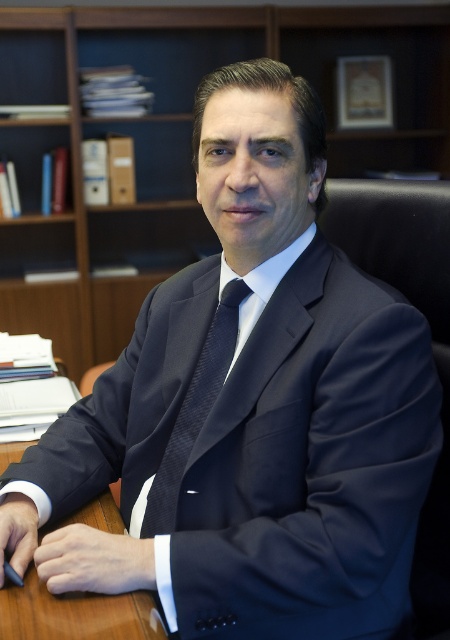
Can you confirm if wooden bookshelf at upper center is shorter than brown wooden table at center?

No.

Describe the element at coordinates (179, 141) in the screenshot. I see `wooden bookshelf at upper center` at that location.

This screenshot has height=640, width=450. In order to click on wooden bookshelf at upper center in this screenshot , I will do (179, 141).

Does wooden bookshelf at upper center have a lesser width compared to navy blue textured tie at center?

Incorrect, wooden bookshelf at upper center's width is not less than navy blue textured tie at center's.

Which is behind, point (133, 253) or point (181, 422)?

The point (133, 253) is behind.

Between point (144, 182) and point (162, 524), which one is positioned in front?

Positioned in front is point (162, 524).

Where is `wooden bookshelf at upper center`? Image resolution: width=450 pixels, height=640 pixels. wooden bookshelf at upper center is located at coordinates (179, 141).

Is brown wooden table at center behind navy blue textured tie at center?

No, it is in front of navy blue textured tie at center.

Between point (18, 605) and point (234, 339), which one is positioned in front?

Positioned in front is point (18, 605).

Where is `brown wooden table at center`? The image size is (450, 640). brown wooden table at center is located at coordinates (76, 612).